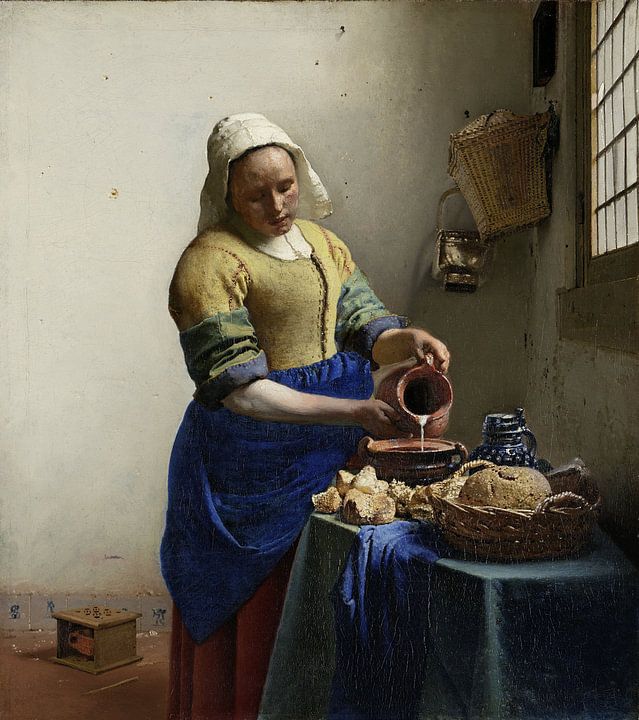
Where is `earthenware container`? The height and width of the screenshot is (720, 639). earthenware container is located at coordinates (422, 464).